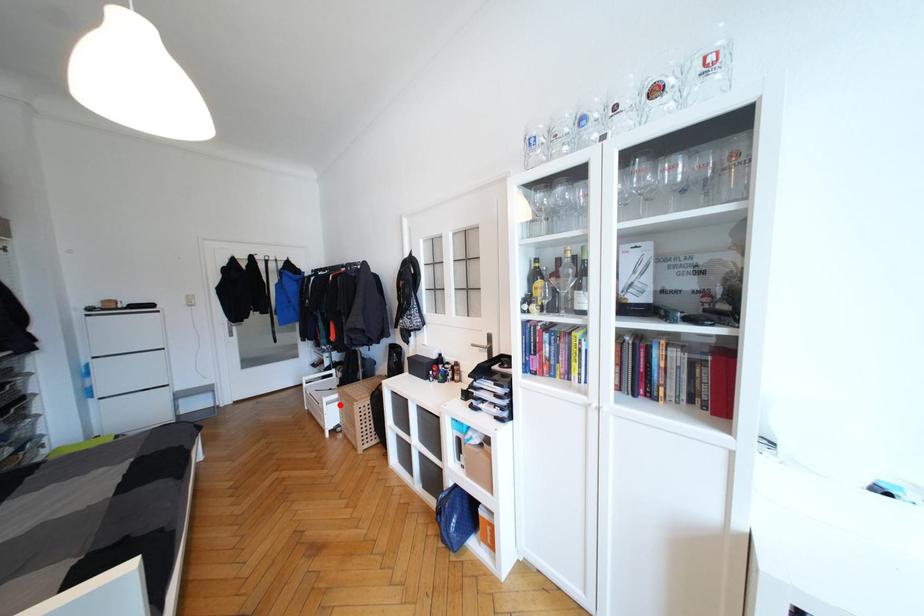
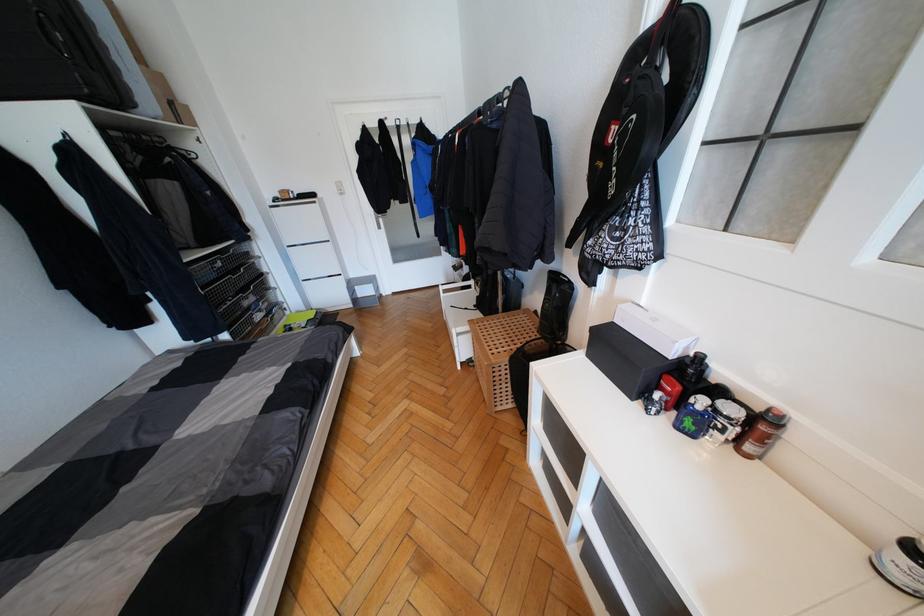
Question: I am providing you with two images of the same scene from different viewpoints. In image1, a red point is highlighted. Considering the same 3D point in image2, which of the following is correct?

Choices:
 (A) It is closer
 (B) It is farther

Answer: (A)